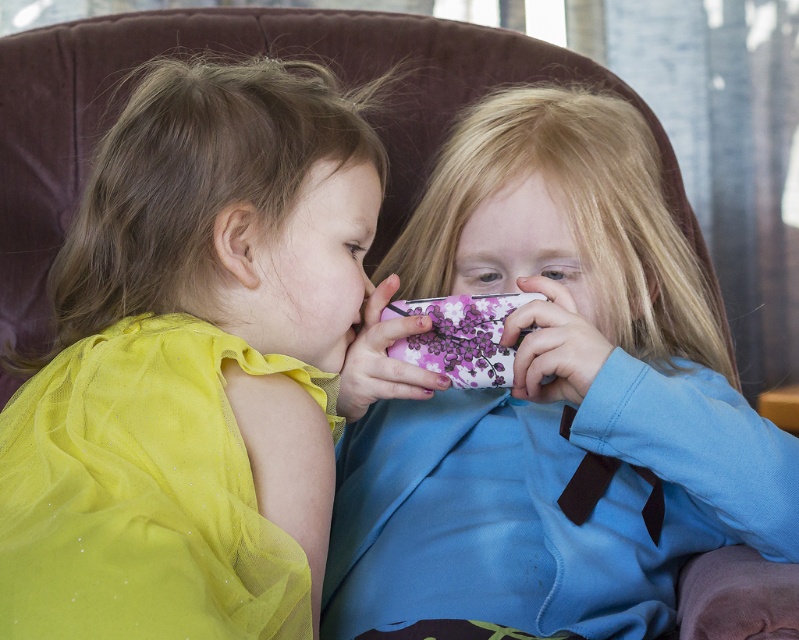
Question: Which of the following is the closest to the observer?

Choices:
 (A) (34, 403)
 (B) (428, 579)
 (C) (235, 364)

Answer: (C)

Question: Which point is farther to the camera?

Choices:
 (A) matte yellow dress at left
 (B) shiny yellow tulle dress at left

Answer: (B)

Question: Is the position of purple floral phone at center more distant than that of shiny yellow tulle dress at left?

Choices:
 (A) yes
 (B) no

Answer: (A)

Question: Can you confirm if matte yellow dress at left is wider than shiny yellow tulle dress at left?

Choices:
 (A) no
 (B) yes

Answer: (B)

Question: Which point is farther from the camera taking this photo?

Choices:
 (A) (396, 595)
 (B) (244, 132)

Answer: (A)

Question: Can you confirm if purple floral phone at center is positioned below shiny yellow tulle dress at left?

Choices:
 (A) yes
 (B) no

Answer: (B)